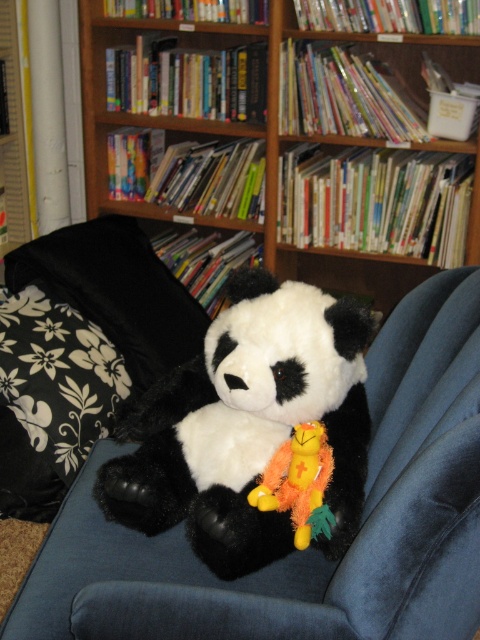
Question: Which point is closer to the camera?

Choices:
 (A) (308, 326)
 (B) (335, 520)

Answer: (B)

Question: Can you confirm if soft plush panda at center is wider than fluffy yellow plush at center?

Choices:
 (A) no
 (B) yes

Answer: (B)

Question: Is wooden bookshelf at upper center closer to camera compared to soft plush panda at center?

Choices:
 (A) no
 (B) yes

Answer: (A)

Question: Among these objects, which one is nearest to the camera?

Choices:
 (A) fluffy yellow plush at center
 (B) wooden bookshelf at upper center
 (C) soft plush panda at center

Answer: (C)

Question: Does wooden bookshelf at upper center appear under fluffy yellow plush at center?

Choices:
 (A) no
 (B) yes

Answer: (A)

Question: Which of the following is the farthest from the observer?

Choices:
 (A) [312, 522]
 (B) [331, 266]
 (C) [243, 483]

Answer: (B)